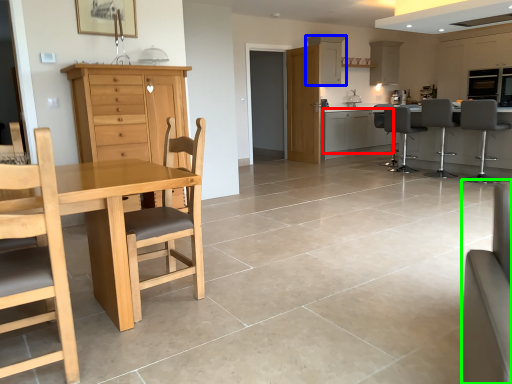
Question: Which is farther away from cabinetry (highlighted by a red box)? cabinetry (highlighted by a blue box) or couch (highlighted by a green box)?

Choices:
 (A) cabinetry
 (B) couch

Answer: (B)